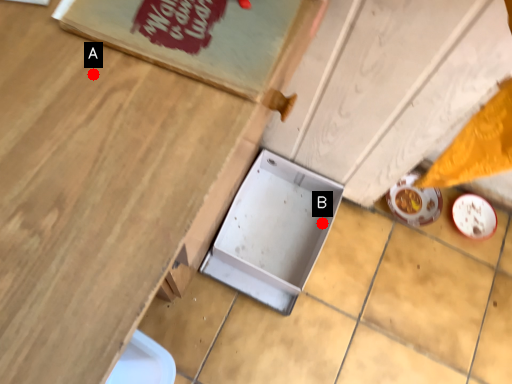
Question: Two points are circled on the image, labeled by A and B beside each circle. Which point is further to the camera?

Choices:
 (A) A is further
 (B) B is further

Answer: (B)